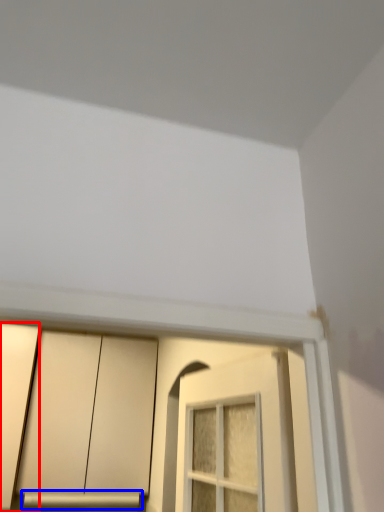
Question: Which object appears farthest to the camera in this image, door (highlighted by a red box) or window sill (highlighted by a blue box)?

Choices:
 (A) door
 (B) window sill

Answer: (B)